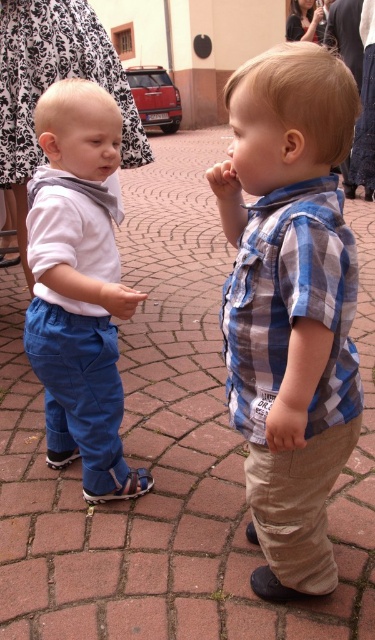
This screenshot has width=375, height=640. Describe the element at coordinates (289, 298) in the screenshot. I see `blue plaid shirt at center` at that location.

Is point (307, 344) farther from viewer compared to point (112, 499)?

That is False.

Find the location of a particular element. Image resolution: width=375 pixels, height=640 pixels. blue plaid shirt at center is located at coordinates (289, 298).

At what (x,y) coordinates should I click in order to perform the action: click on blue plaid shirt at center. Please return your answer as a coordinate pair (x, y). Looking at the image, I should click on (289, 298).

Can you confirm if matte blue pants at left is thinner than brown leather sandal at lower left?

No, matte blue pants at left is not thinner than brown leather sandal at lower left.

Is point (91, 99) behind point (142, 488)?

No, it is not.

Which is behind, point (55, 108) or point (87, 497)?

Point (87, 497)

Locate an element on the screen. matte blue pants at left is located at coordinates (76, 280).

Does blue plaid shirt at center have a larger size compared to matte blue pants at lower left?

Correct, blue plaid shirt at center is larger in size than matte blue pants at lower left.

Is point (274, 292) in front of point (127, 310)?

Yes, it is.

Where is `blue plaid shirt at center`? blue plaid shirt at center is located at coordinates (289, 298).